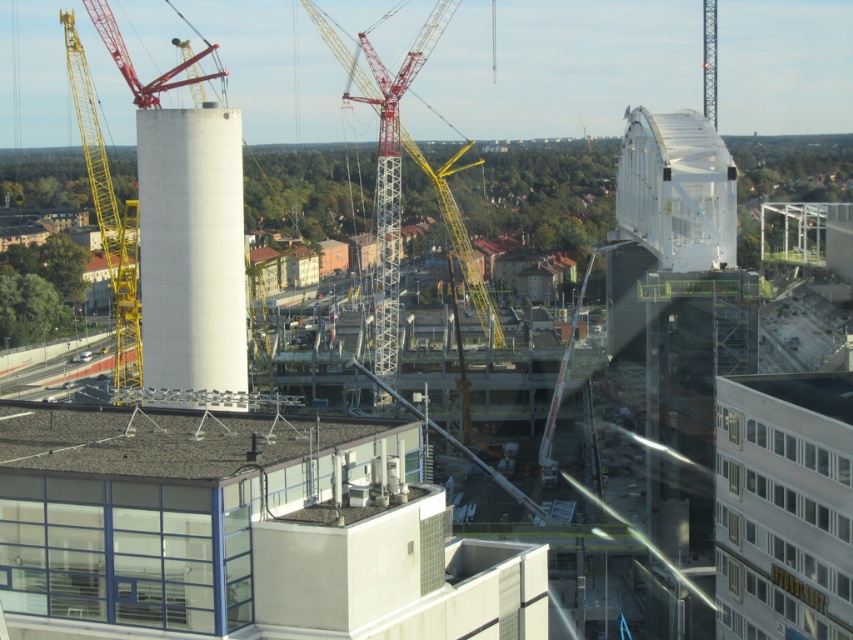
Question: Where is yellow metal crane at center located in relation to red metallic crane at upper left in the image?

Choices:
 (A) right
 (B) left

Answer: (A)

Question: Can you confirm if white smooth cylinder at center is positioned below red metallic crane at upper left?

Choices:
 (A) yes
 (B) no

Answer: (A)

Question: Which object is positioned farthest from the white smooth cylinder at center?

Choices:
 (A) yellow metallic crane at left
 (B) yellow metal crane at center

Answer: (B)

Question: Is transparent glass bridge at upper right closer to the viewer compared to yellow metallic crane at left?

Choices:
 (A) yes
 (B) no

Answer: (A)

Question: Which object appears farthest from the camera in this image?

Choices:
 (A) white smooth cylinder at center
 (B) yellow metal crane at center
 (C) yellow metallic crane at left

Answer: (B)

Question: Among these objects, which one is nearest to the camera?

Choices:
 (A) yellow metal crane at center
 (B) yellow metallic crane at left

Answer: (B)